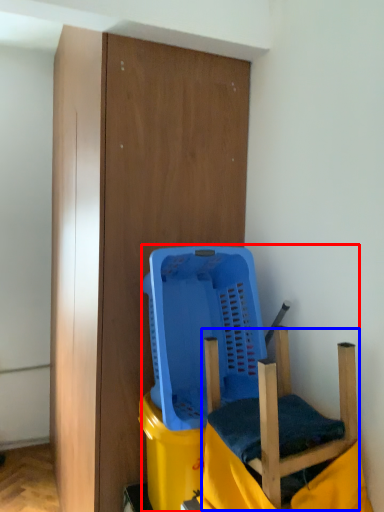
Question: Which object is further to the camera taking this photo, furniture (highlighted by a red box) or swivel chair (highlighted by a blue box)?

Choices:
 (A) furniture
 (B) swivel chair

Answer: (A)